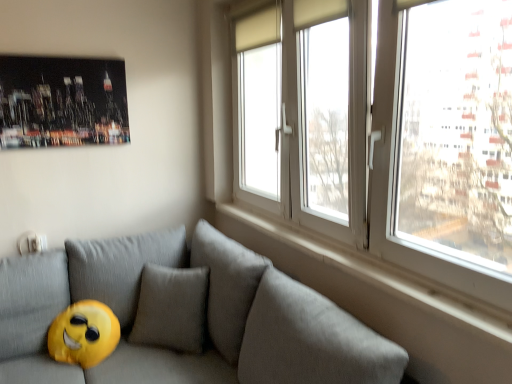
Question: Can we say white smooth window sill at upper right lies outside gray fabric couch at lower left?

Choices:
 (A) yes
 (B) no

Answer: (A)

Question: Would you consider white smooth window sill at upper right to be distant from gray fabric couch at lower left?

Choices:
 (A) yes
 (B) no

Answer: (B)

Question: From a real-world perspective, does white smooth window sill at upper right stand above gray fabric couch at lower left?

Choices:
 (A) yes
 (B) no

Answer: (A)

Question: Does white smooth window sill at upper right have a smaller size compared to gray fabric couch at lower left?

Choices:
 (A) yes
 (B) no

Answer: (A)

Question: From the image's perspective, is white smooth window sill at upper right under gray fabric couch at lower left?

Choices:
 (A) no
 (B) yes

Answer: (A)

Question: Is shiny metallic poster at upper left bigger or smaller than white smooth window sill at upper right?

Choices:
 (A) small
 (B) big

Answer: (B)

Question: From their relative heights in the image, would you say shiny metallic poster at upper left is taller or shorter than white smooth window sill at upper right?

Choices:
 (A) short
 (B) tall

Answer: (B)

Question: Is shiny metallic poster at upper left inside the boundaries of white smooth window sill at upper right, or outside?

Choices:
 (A) inside
 (B) outside

Answer: (B)

Question: From a real-world perspective, is shiny metallic poster at upper left physically located above or below white smooth window sill at upper right?

Choices:
 (A) below
 (B) above

Answer: (B)

Question: Do you think white plastic window at upper right is within gray fabric couch at lower left, or outside of it?

Choices:
 (A) inside
 (B) outside

Answer: (B)

Question: From the image's perspective, is white plastic window at upper right above or below gray fabric couch at lower left?

Choices:
 (A) below
 (B) above

Answer: (B)

Question: Considering the positions of white plastic window at upper right and gray fabric couch at lower left in the image, is white plastic window at upper right bigger or smaller than gray fabric couch at lower left?

Choices:
 (A) small
 (B) big

Answer: (A)

Question: Is white plastic window at upper right wider or thinner than gray fabric couch at lower left?

Choices:
 (A) wide
 (B) thin

Answer: (B)

Question: In terms of size, does white plastic window at upper right appear bigger or smaller than shiny metallic poster at upper left?

Choices:
 (A) big
 (B) small

Answer: (A)

Question: From a real-world perspective, is white plastic window at upper right above or below shiny metallic poster at upper left?

Choices:
 (A) above
 (B) below

Answer: (B)